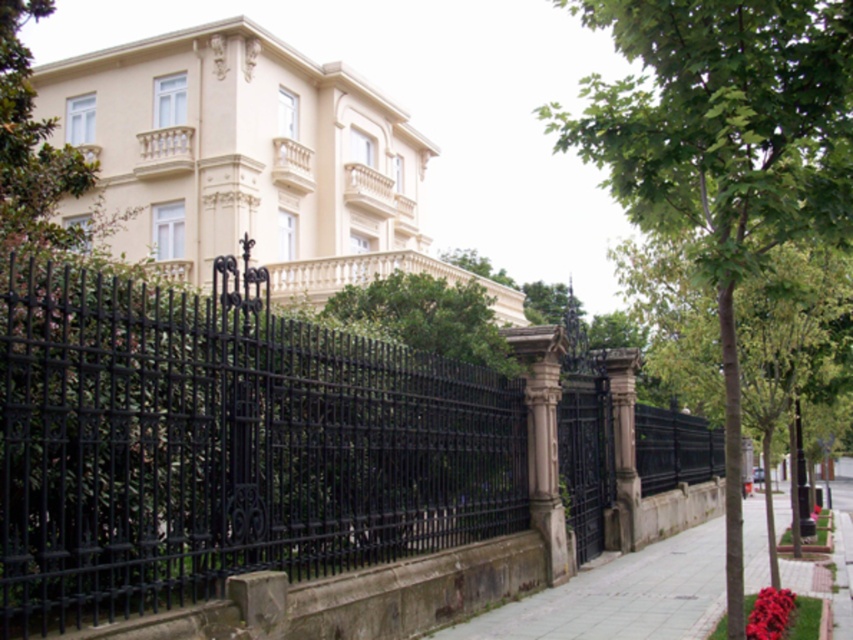
You are standing in front of the grand building and want to take a photo of the black wrought iron fence at center. If your camera has a maximum focus range of 4 meters, will it be able to capture the fence clearly?

The black wrought iron fence at center is 4.54 meters away from the camera. Since the maximum focus range is 4 meters, the camera cannot capture the fence clearly at this distance.

You are a visitor approaching the property and want to enter through the gate. You see the black wrought iron fence at center and the green leafy tree at center. Which object should you walk around to reach the entrance?

You should walk around the black wrought iron fence at center because it is positioned on the left side of the green leafy tree at center, so the entrance is likely behind the fence.

You are standing in front of the grand building and want to take a photo of the black wrought iron fence at center and the green leafy tree at center. Which object should you focus on first to ensure both are in the frame?

The black wrought iron fence at center is located below the green leafy tree at center, so you should focus on the green leafy tree at center first to ensure both are in the frame.